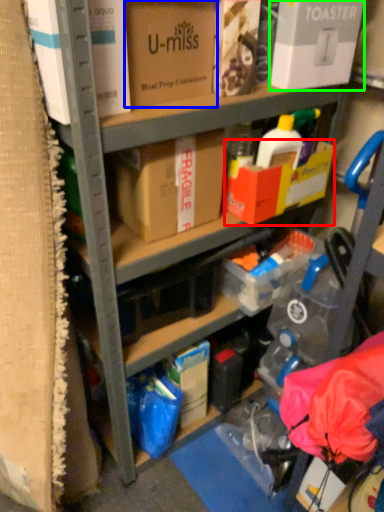
Question: Which object is positioned farthest from box (highlighted by a red box)? Select from box (highlighted by a blue box) and box (highlighted by a green box).

Choices:
 (A) box
 (B) box

Answer: (A)